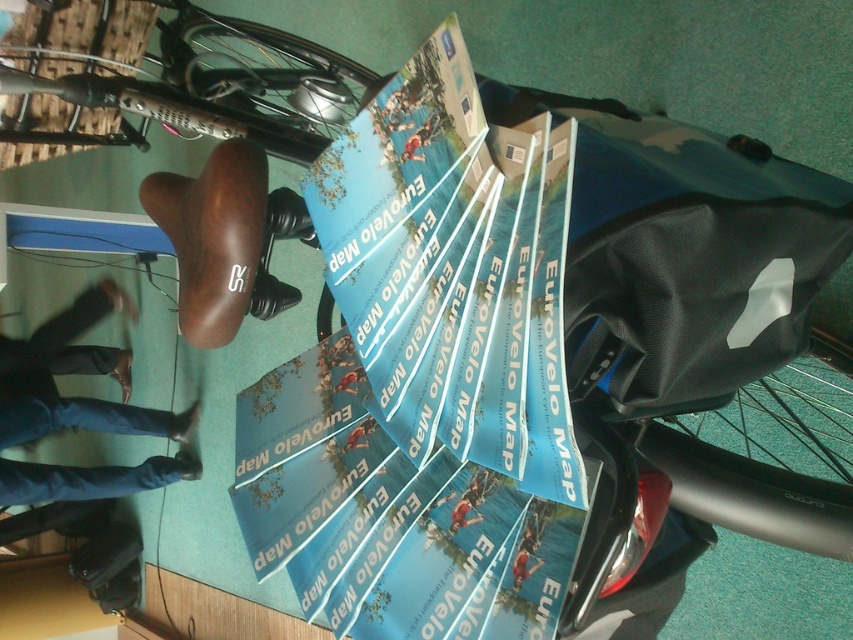
Question: Which point appears farthest from the camera in this image?

Choices:
 (A) (514, 564)
 (B) (178, 458)
 (C) (474, 522)

Answer: (B)

Question: Can you confirm if jeans at lower left is bigger than blue paper map at center?

Choices:
 (A) yes
 (B) no

Answer: (A)

Question: Where is blue jeans at lower left located in relation to blue paper map at center in the image?

Choices:
 (A) above
 (B) below

Answer: (B)

Question: Is matte black bag at center wider than jeans at lower left?

Choices:
 (A) no
 (B) yes

Answer: (B)

Question: Which object is positioned farthest from the matte black bag at center?

Choices:
 (A) blue paper map at center
 (B) blue fabric map at center
 (C) blue jeans at lower left
 (D) jeans at lower left

Answer: (D)

Question: Among these objects, which one is nearest to the camera?

Choices:
 (A) jeans at lower left
 (B) blue jeans at lower left
 (C) matte black bag at center

Answer: (C)